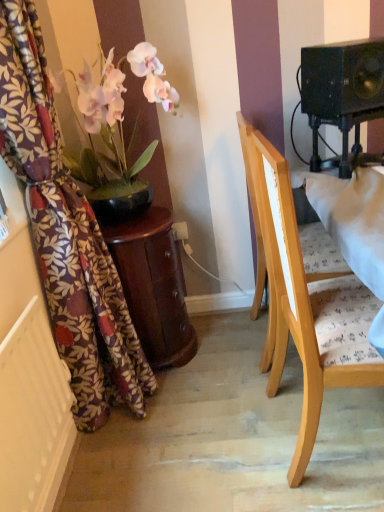
Question: Is mahogany wood side table at left located outside black matte speaker at upper right?

Choices:
 (A) no
 (B) yes

Answer: (B)

Question: From a real-world perspective, is mahogany wood side table at left under black matte speaker at upper right?

Choices:
 (A) yes
 (B) no

Answer: (A)

Question: Can you confirm if mahogany wood side table at left is bigger than black matte speaker at upper right?

Choices:
 (A) no
 (B) yes

Answer: (B)

Question: Can you confirm if mahogany wood side table at left is smaller than black matte speaker at upper right?

Choices:
 (A) yes
 (B) no

Answer: (B)

Question: From the image's perspective, is mahogany wood side table at left beneath black matte speaker at upper right?

Choices:
 (A) yes
 (B) no

Answer: (A)

Question: From the image's perspective, would you say mahogany wood side table at left is positioned over black matte speaker at upper right?

Choices:
 (A) yes
 (B) no

Answer: (B)

Question: Is floral fabric curtain at left far away from white textured radiator at lower left?

Choices:
 (A) yes
 (B) no

Answer: (B)

Question: Considering the relative sizes of floral fabric curtain at left and white textured radiator at lower left in the image provided, is floral fabric curtain at left wider than white textured radiator at lower left?

Choices:
 (A) yes
 (B) no

Answer: (A)

Question: Is floral fabric curtain at left not within white textured radiator at lower left?

Choices:
 (A) yes
 (B) no

Answer: (A)

Question: Is floral fabric curtain at left at the left side of white textured radiator at lower left?

Choices:
 (A) yes
 (B) no

Answer: (B)

Question: Considering the relative sizes of floral fabric curtain at left and white textured radiator at lower left in the image provided, is floral fabric curtain at left smaller than white textured radiator at lower left?

Choices:
 (A) yes
 (B) no

Answer: (B)

Question: Does floral fabric curtain at left have a larger size compared to white textured radiator at lower left?

Choices:
 (A) yes
 (B) no

Answer: (A)

Question: Considering the relative sizes of white textured radiator at lower left and floral fabric curtain at left in the image provided, is white textured radiator at lower left shorter than floral fabric curtain at left?

Choices:
 (A) yes
 (B) no

Answer: (A)